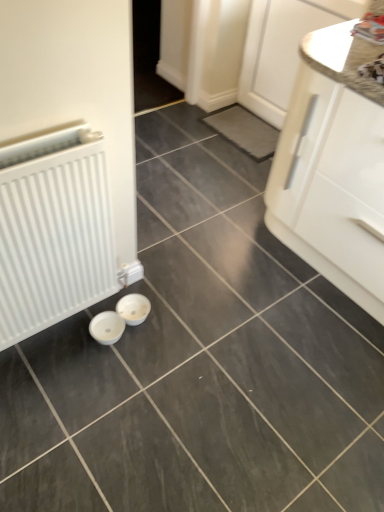
Question: Does point (354, 15) appear closer or farther from the camera than point (59, 166)?

Choices:
 (A) farther
 (B) closer

Answer: (A)

Question: In terms of height, does white glossy cabinet at upper right, which appears as the first cabinetry when viewed from the top, look taller or shorter compared to white matte radiator at left?

Choices:
 (A) short
 (B) tall

Answer: (B)

Question: Which of these objects is positioned farthest from the white glossy cabinet at right, marked as the second cabinetry in a top-to-bottom arrangement?

Choices:
 (A) white matte radiator at left
 (B) white glossy cabinet at upper right, which appears as the first cabinetry when viewed from the top

Answer: (A)

Question: Which of these objects is positioned closest to the white matte radiator at left?

Choices:
 (A) white glossy cabinet at upper right, the 2th cabinetry when ordered from bottom to top
 (B) white glossy cabinet at right, the 1th cabinetry when ordered from bottom to top

Answer: (B)